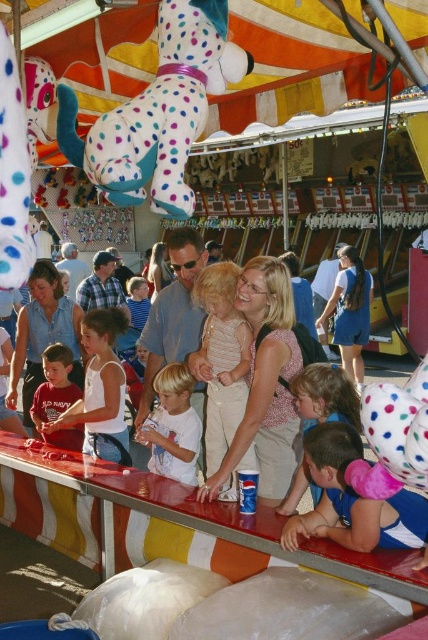
Question: Does matte blue shirt at center appear on the right side of light brown hair at center?

Choices:
 (A) no
 (B) yes

Answer: (A)

Question: Where is light blue fabric at lower right located in relation to matte blue shirt at center in the image?

Choices:
 (A) right
 (B) left

Answer: (A)

Question: Does light beige cotton dress at center appear on the left side of white cotton shirt at center?

Choices:
 (A) no
 (B) yes

Answer: (A)

Question: Which point is farther from the camera taking this photo?

Choices:
 (A) (202, 426)
 (B) (300, 493)

Answer: (A)

Question: Which object is the farthest from the light brown hair at center?

Choices:
 (A) white polka-dotted plush dog at upper center
 (B) matte white shirt at center
 (C) white cotton shirt at center
 (D) light beige cotton dress at center

Answer: (A)

Question: Among these objects, which one is farthest from the camera?

Choices:
 (A) light brown hair at lower center
 (B) light beige cotton dress at center
 (C) light blue fabric at lower right
 (D) denim shirt at center

Answer: (D)